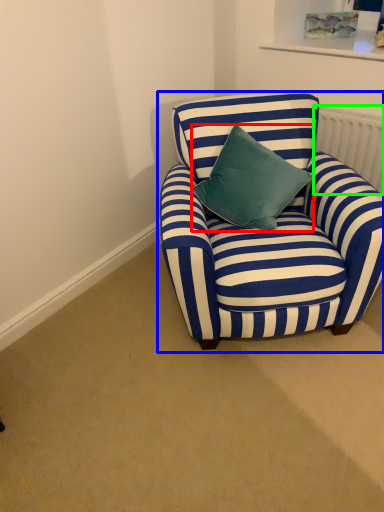
Question: Estimate the real-world distances between objects in this image. Which object is farther from pillow (highlighted by a red box), chair (highlighted by a blue box) or radiator (highlighted by a green box)?

Choices:
 (A) chair
 (B) radiator

Answer: (B)